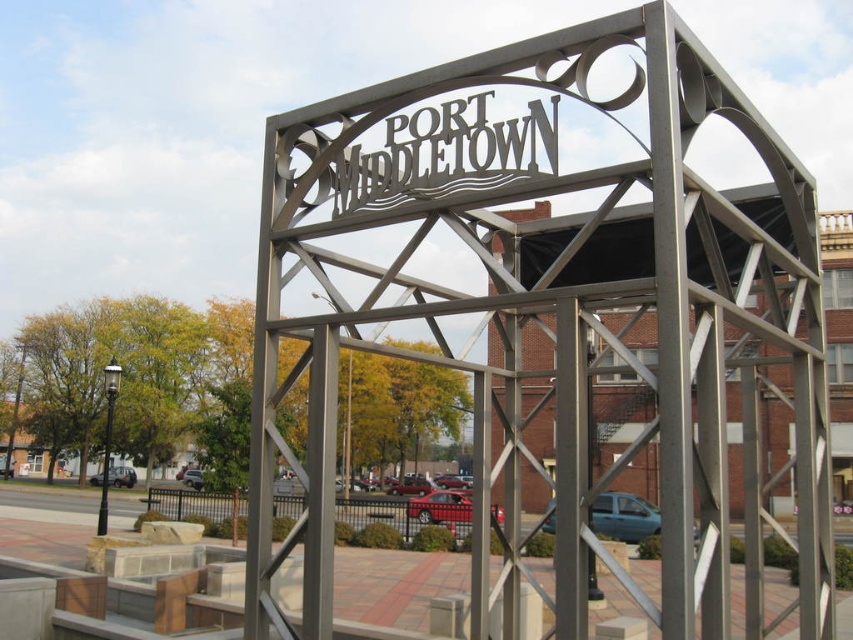
Question: Can you confirm if metallic red car at center is positioned to the left of matte black sedan at lower left?

Choices:
 (A) yes
 (B) no

Answer: (B)

Question: Among these objects, which one is farthest from the camera?

Choices:
 (A) matte black sedan at lower left
 (B) teal metallic car at center

Answer: (A)

Question: Considering the relative positions of metallic sign at center and metallic red car at center in the image provided, where is metallic sign at center located with respect to metallic red car at center?

Choices:
 (A) below
 (B) above

Answer: (B)

Question: Which object is the closest to the matte black sedan at lower left?

Choices:
 (A) teal metallic car at center
 (B) metallic red car at center

Answer: (B)

Question: Which is nearer to the matte black sedan at lower left?

Choices:
 (A) metallic red car at center
 (B) teal metallic car at center

Answer: (A)

Question: Does metallic sign at center appear on the right side of matte black sedan at lower left?

Choices:
 (A) no
 (B) yes

Answer: (B)